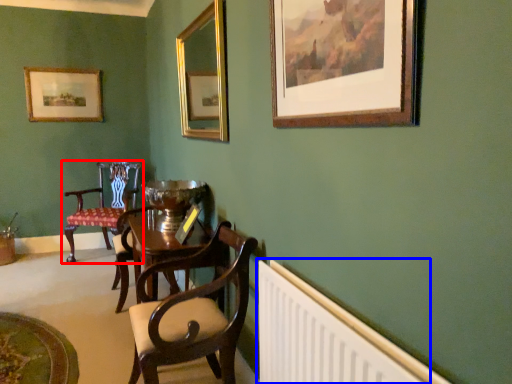
Question: Among these objects, which one is farthest to the camera, chair (highlighted by a red box) or radiator (highlighted by a blue box)?

Choices:
 (A) chair
 (B) radiator

Answer: (A)